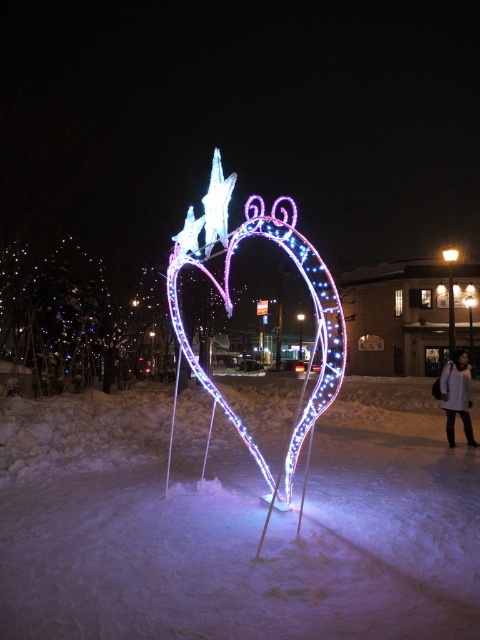
Question: Is illuminated plastic heart at center to the left of white wool coat at lower right from the viewer's perspective?

Choices:
 (A) yes
 (B) no

Answer: (A)

Question: Does icy white snow at center appear under white wool coat at lower right?

Choices:
 (A) no
 (B) yes

Answer: (B)

Question: Which point is closer to the camera taking this photo?

Choices:
 (A) (456, 576)
 (B) (454, 387)
 (C) (336, 364)

Answer: (A)

Question: Which of the following is the closest to the observer?

Choices:
 (A) (443, 374)
 (B) (219, 627)

Answer: (B)

Question: Is illuminated plastic heart at center smaller than white wool coat at lower right?

Choices:
 (A) yes
 (B) no

Answer: (B)

Question: Which point is closer to the camera taking this photo?

Choices:
 (A) (312, 410)
 (B) (408, 493)

Answer: (A)